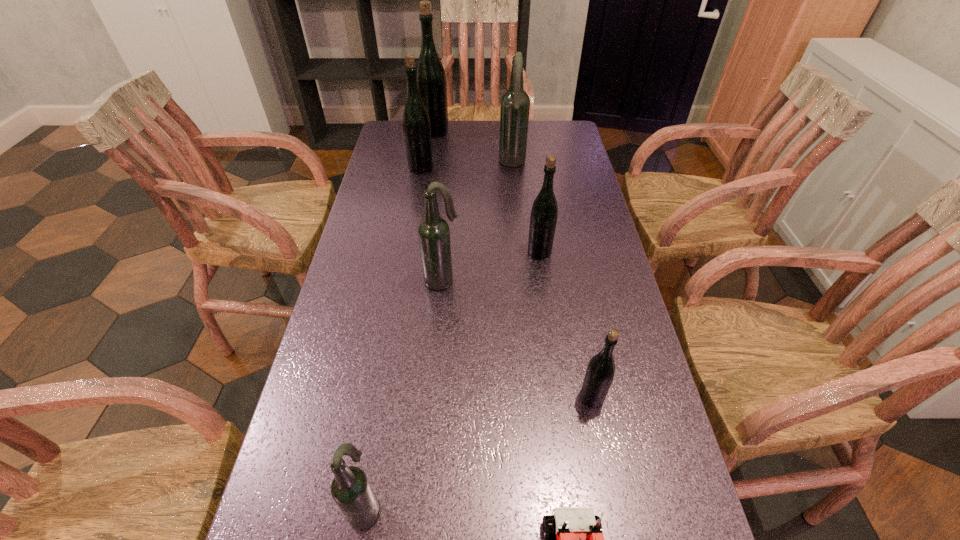
Find the location of a particular element. This screenshot has height=540, width=960. the rightmost green beer bottle is located at coordinates (599, 375).

Find the location of a particular element. This screenshot has height=540, width=960. the nearest dark beer bottle is located at coordinates (350, 488).

At what (x,y) coordinates should I click in order to perform the action: click on the nearest beer bottle. Please return your answer as a coordinate pair (x, y). This screenshot has height=540, width=960. Looking at the image, I should click on (350, 488).

Locate an element on the screen. Image resolution: width=960 pixels, height=540 pixels. free space located on the front of the tallest object is located at coordinates (428, 176).

Identify the location of free space located on the left of the farthest dark beer bottle. (428, 164).

Image resolution: width=960 pixels, height=540 pixels. Find the location of `vacant space situated on the left of the third nearest green beer bottle`. vacant space situated on the left of the third nearest green beer bottle is located at coordinates (374, 168).

The width and height of the screenshot is (960, 540). What are the coordinates of `vacant area located on the front of the fourth farthest beer bottle` in the screenshot? It's located at (553, 348).

Where is `vacant point located on the front of the second farthest dark beer bottle`? Image resolution: width=960 pixels, height=540 pixels. vacant point located on the front of the second farthest dark beer bottle is located at coordinates (429, 444).

Where is `vacant space located on the back of the nearest green beer bottle`? vacant space located on the back of the nearest green beer bottle is located at coordinates (575, 310).

Where is `free spot located on the back of the smallest dark beer bottle`? This screenshot has width=960, height=540. free spot located on the back of the smallest dark beer bottle is located at coordinates (373, 456).